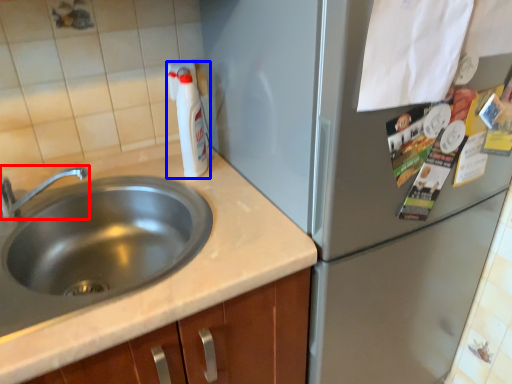
Question: Which point is closer to the camera, tap (highlighted by a red box) or bottle (highlighted by a blue box)?

Choices:
 (A) tap
 (B) bottle

Answer: (A)